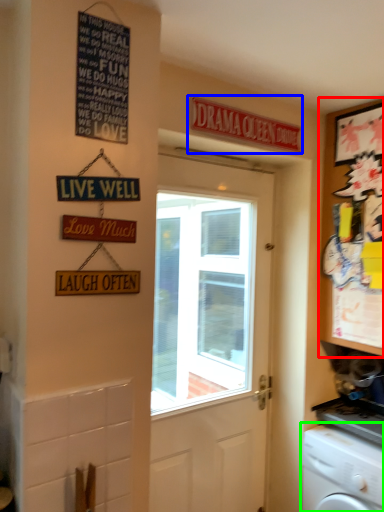
Question: Based on their relative distances, which object is farther from cabinetry (highlighted by a red box)? Choose from sign (highlighted by a blue box) and washing machine (highlighted by a green box).

Choices:
 (A) sign
 (B) washing machine

Answer: (B)